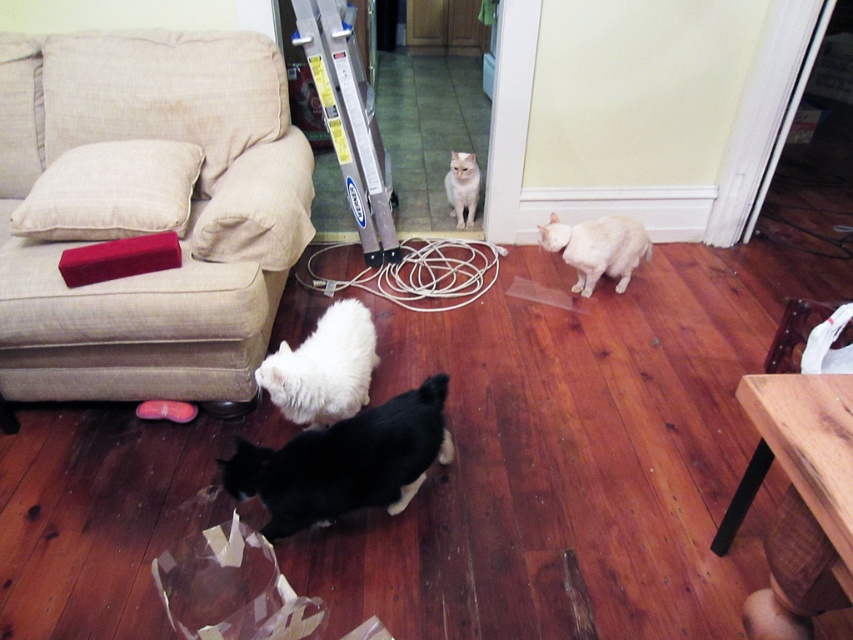
You are a delivery person who just arrived at the house. You see a transparent plastic bag at lower center and a white fluffy cat at center. Which object is closer to you?

The transparent plastic bag at lower center is closer to you because it is in front of the white fluffy cat at center.

You are standing in the living room and want to place a small decoration on the closest point between point (845, 353) and point (581, 262). Which point should you choose?

Point (845, 353) is closer to the camera than point (581, 262), so you should choose point (845, 353) to place the decoration.

You are a delivery person who just arrived at the house. You need to place a package that is 1.2 meters long on the floor between the black fur cat at lower center and the white paper bag at lower right. Is there enough space for the package?

The distance between the black fur cat at lower center and the white paper bag at lower right is 1.10 meters. Since the package is 1.2 meters long, it will not fit in the available space.